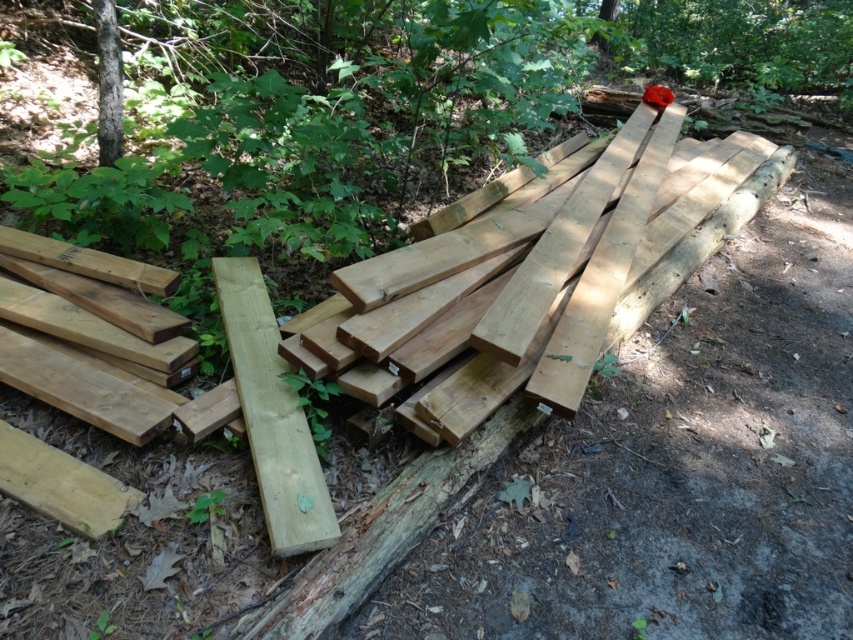
You are a carpenter trying to decide which material to use for a project that requires a wider surface. You have the natural light wood plank at center and the smooth brown tree trunk at upper left available. Which one should you choose based on their widths?

The natural light wood plank at center has a greater width than the smooth brown tree trunk at upper left, so you should choose the natural light wood plank at center for the project requiring a wider surface.

You are standing in the wooded area and want to pick up the natural light wood plank at center and the smooth brown tree trunk at upper left. Which object will you need to walk towards first to reach the closer one?

The natural light wood plank at center is closer to the viewer than the smooth brown tree trunk at upper left, so you should first walk towards the natural light wood plank at center to reach the closer one.